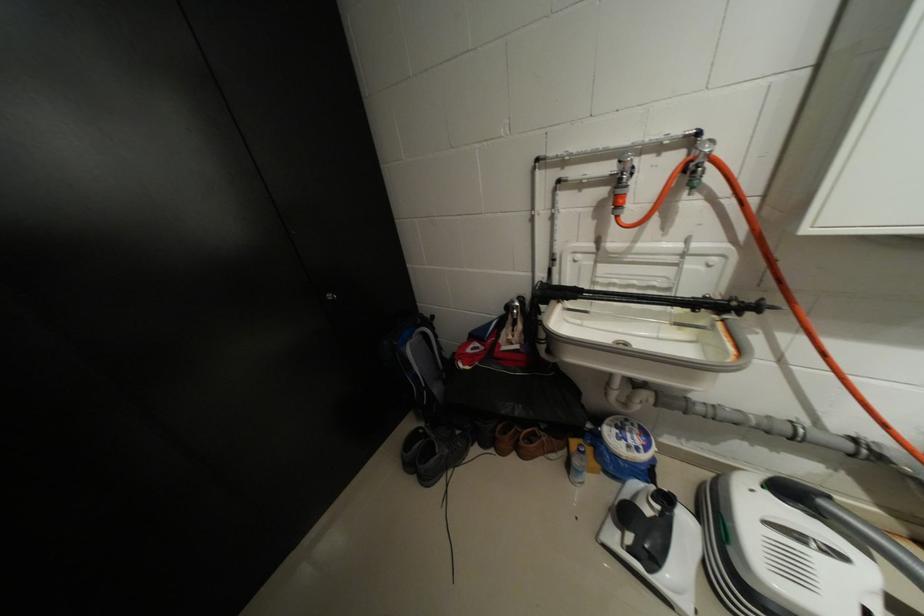
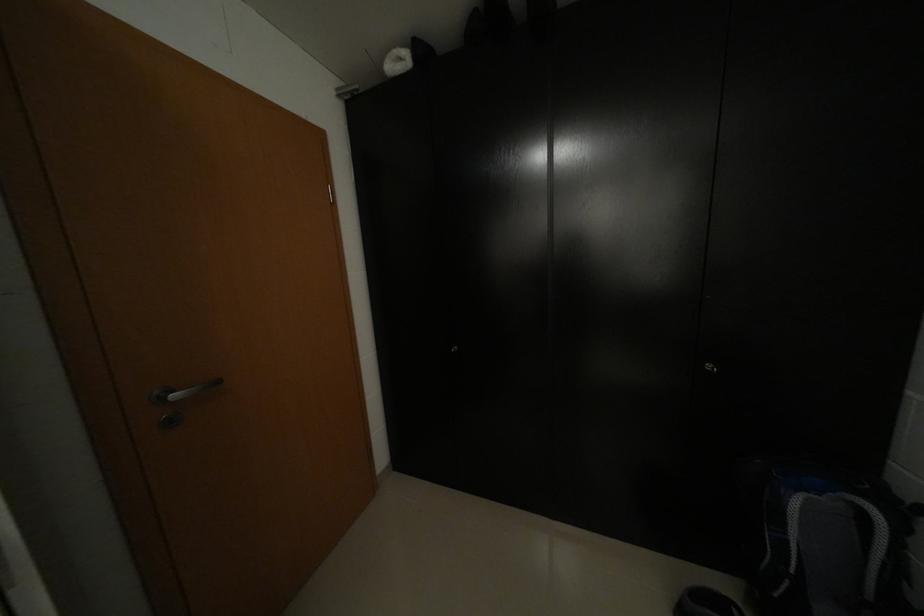
Question: The first image is from the beginning of the video and the second image is from the end. How did the camera likely rotate when shooting the video?

Choices:
 (A) Left
 (B) Right
 (C) Up
 (D) Down

Answer: (A)